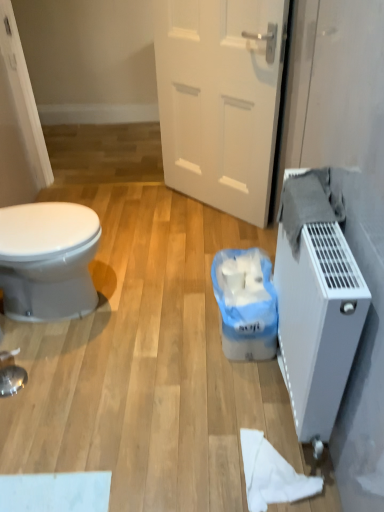
Image resolution: width=384 pixels, height=512 pixels. I want to click on vacant region to the left of white plastic radiator at right, so tap(198, 393).